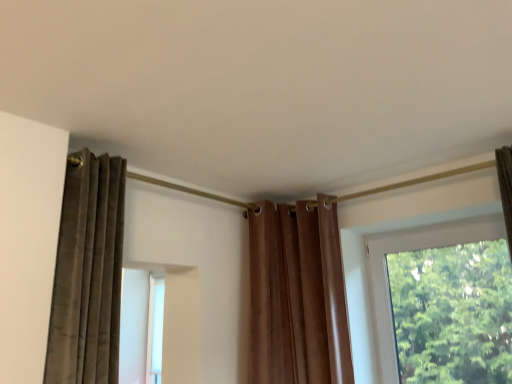
Question: Is transparent glass window at right located outside brown velvet curtain at center?

Choices:
 (A) no
 (B) yes

Answer: (B)

Question: Is transparent glass window at right to the right of brown velvet curtain at center from the viewer's perspective?

Choices:
 (A) no
 (B) yes

Answer: (B)

Question: Can you confirm if transparent glass window at right is shorter than brown velvet curtain at center?

Choices:
 (A) no
 (B) yes

Answer: (B)

Question: Does transparent glass window at right lie behind brown velvet curtain at center?

Choices:
 (A) no
 (B) yes

Answer: (A)

Question: From a real-world perspective, is transparent glass window at right physically above brown velvet curtain at center?

Choices:
 (A) no
 (B) yes

Answer: (A)

Question: Are transparent glass window at right and brown velvet curtain at center making contact?

Choices:
 (A) yes
 (B) no

Answer: (B)

Question: From the image's perspective, would you say brown velvet curtain at center is shown under transparent glass window at right?

Choices:
 (A) yes
 (B) no

Answer: (B)

Question: Is brown velvet curtain at center at the left side of transparent glass window at right?

Choices:
 (A) yes
 (B) no

Answer: (A)

Question: Would you say brown velvet curtain at center is a long distance from transparent glass window at right?

Choices:
 (A) yes
 (B) no

Answer: (B)

Question: Is brown velvet curtain at center positioned before transparent glass window at right?

Choices:
 (A) no
 (B) yes

Answer: (A)

Question: Does brown velvet curtain at center lie behind transparent glass window at right?

Choices:
 (A) no
 (B) yes

Answer: (B)

Question: Is transparent glass window at right at the back of brown velvet curtain at center?

Choices:
 (A) yes
 (B) no

Answer: (B)

Question: Based on their positions, is brown velvet curtain at center located to the left or right of transparent glass window at right?

Choices:
 (A) left
 (B) right

Answer: (A)